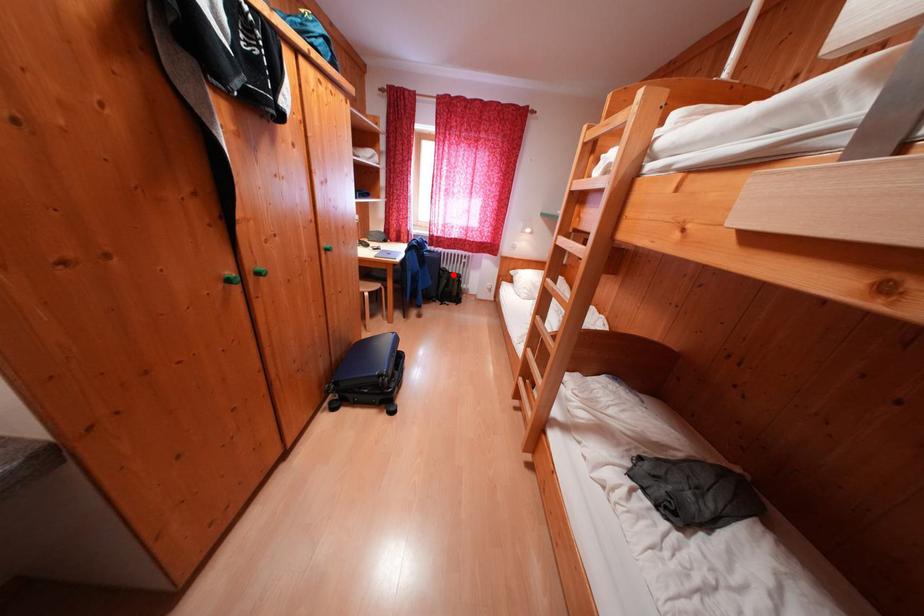
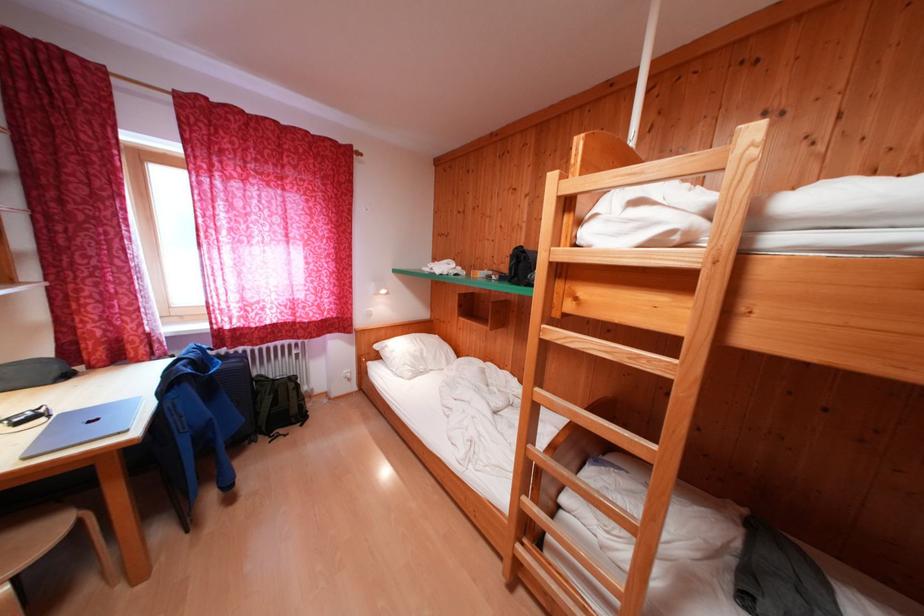
Where in the second image is the point corresponding to the highlighted location from the first image?

(271, 383)